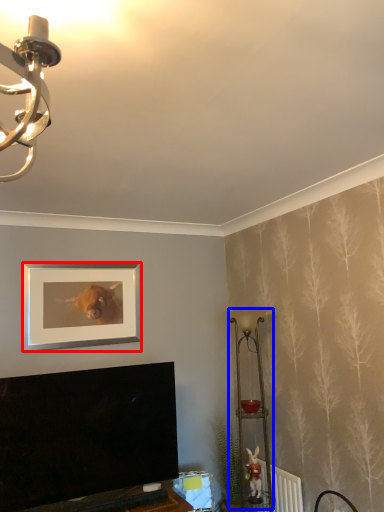
Question: Which object appears farthest to the camera in this image, picture frame (highlighted by a red box) or table lamp (highlighted by a blue box)?

Choices:
 (A) picture frame
 (B) table lamp

Answer: (A)